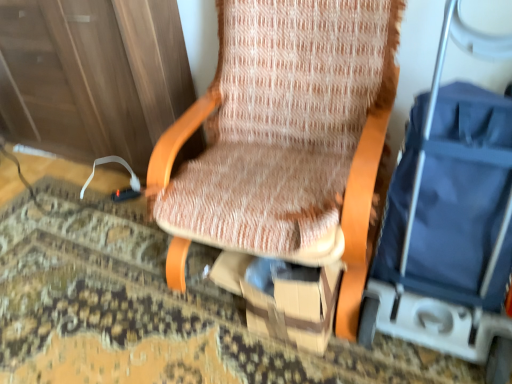
The height and width of the screenshot is (384, 512). Describe the element at coordinates (284, 300) in the screenshot. I see `brown cardboard box at center` at that location.

The height and width of the screenshot is (384, 512). In order to click on textured fabric chair at center in this screenshot , I will do `click(286, 153)`.

Can we say textured fabric chair at center lies outside brown cardboard box at center?

Yes.

Considering the sizes of objects textured fabric chair at center and brown cardboard box at center in the image provided, who is wider, textured fabric chair at center or brown cardboard box at center?

textured fabric chair at center.

Is textured fabric chair at center taller than brown cardboard box at center?

Yes, textured fabric chair at center is taller than brown cardboard box at center.

Is the surface of textured fabric chair at center in direct contact with brown cardboard box at center?

No, textured fabric chair at center is not next to brown cardboard box at center.

Which is farther, [280,181] or [398,280]?

Point [280,181]

Is textured fabric chair at center behind blue fabric baby carriage at right?

Yes, textured fabric chair at center is further from the camera.

Which object is positioned more to the right, textured fabric chair at center or blue fabric baby carriage at right?

blue fabric baby carriage at right.

Is textured fabric chair at center not near blue fabric baby carriage at right?

No.

From a real-world perspective, is brown cardboard box at center located beneath textured fabric chair at center?

Yes, from a real-world perspective, brown cardboard box at center is beneath textured fabric chair at center.

From the image's perspective, which is above, brown cardboard box at center or textured fabric chair at center?

From the image's view, textured fabric chair at center is above.

Is brown cardboard box at center spatially inside textured fabric chair at center, or outside of it?

brown cardboard box at center is spatially positioned inside textured fabric chair at center.

Is point (503, 336) closer or farther from the camera than point (244, 246)?

Point (503, 336) appears to be closer to the viewer than point (244, 246).

Which is more to the left, blue fabric baby carriage at right or textured fabric chair at center?

textured fabric chair at center.

Is blue fabric baby carriage at right aimed at textured fabric chair at center?

No, blue fabric baby carriage at right is not turned towards textured fabric chair at center.

Between blue fabric baby carriage at right and textured fabric chair at center, which one has more height?

Standing taller between the two is blue fabric baby carriage at right.

The width and height of the screenshot is (512, 384). I want to click on cardboard box below the blue fabric baby carriage at right (from the image's perspective), so click(284, 300).

What's the angular difference between brown cardboard box at center and blue fabric baby carriage at right's facing directions?

The angle between the facing direction of brown cardboard box at center and the facing direction of blue fabric baby carriage at right is 1.26 degrees.

From a real-world perspective, is brown cardboard box at center over blue fabric baby carriage at right?

Incorrect, from a real-world perspective, brown cardboard box at center is lower than blue fabric baby carriage at right.

Can we say brown cardboard box at center lies outside blue fabric baby carriage at right?

Yes, brown cardboard box at center is not within blue fabric baby carriage at right.

Can you tell me how much blue fabric baby carriage at right and brown cardboard box at center differ in facing direction?

The facing directions of blue fabric baby carriage at right and brown cardboard box at center are 1.26 degrees apart.

Measure the distance from blue fabric baby carriage at right to brown cardboard box at center.

blue fabric baby carriage at right is 30.35 centimeters from brown cardboard box at center.

Is blue fabric baby carriage at right located outside brown cardboard box at center?

Indeed, blue fabric baby carriage at right is completely outside brown cardboard box at center.

From a real-world perspective, between blue fabric baby carriage at right and brown cardboard box at center, who is vertically higher?

blue fabric baby carriage at right, from a real-world perspective.

At what (x,y) coordinates should I click in order to perform the action: click on chair on the right of brown cardboard box at center. Please return your answer as a coordinate pair (x, y). This screenshot has height=384, width=512. Looking at the image, I should click on (286, 153).

The height and width of the screenshot is (384, 512). Identify the location of chair above the blue fabric baby carriage at right (from the image's perspective). (286, 153).

Considering their positions, is textured fabric chair at center positioned further to brown cardboard box at center than blue fabric baby carriage at right?

Among the two, blue fabric baby carriage at right is located further to brown cardboard box at center.

Considering their positions, is textured fabric chair at center positioned closer to blue fabric baby carriage at right than brown cardboard box at center?

brown cardboard box at center.

Which object lies further to the anchor point textured fabric chair at center, blue fabric baby carriage at right or brown cardboard box at center?

Based on the image, blue fabric baby carriage at right appears to be further to textured fabric chair at center.

Looking at the image, which one is located further to textured fabric chair at center, brown cardboard box at center or blue fabric baby carriage at right?

Based on the image, blue fabric baby carriage at right appears to be further to textured fabric chair at center.

Considering their positions, is blue fabric baby carriage at right positioned closer to brown cardboard box at center than textured fabric chair at center?

textured fabric chair at center lies closer to brown cardboard box at center than the other object.

Considering their positions, is brown cardboard box at center positioned further to blue fabric baby carriage at right than textured fabric chair at center?

textured fabric chair at center lies further to blue fabric baby carriage at right than the other object.

Where is `chair between blue fabric baby carriage at right and brown cardboard box at center from front to back`? This screenshot has height=384, width=512. chair between blue fabric baby carriage at right and brown cardboard box at center from front to back is located at coordinates (286, 153).